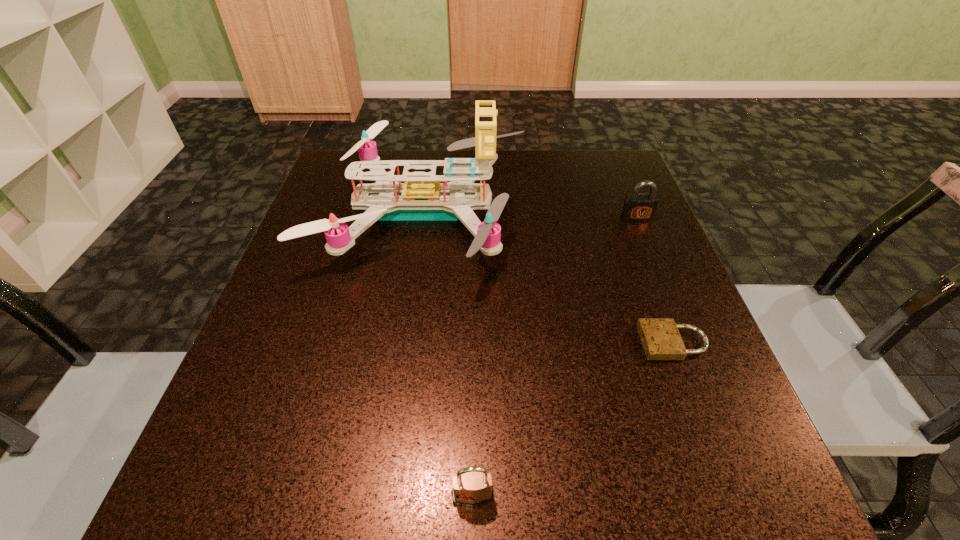
The height and width of the screenshot is (540, 960). What are the coordinates of `vacant space that satisfies the following two spatial constraints: 1. on the front of the farthest padlock near the keyhole; 2. on the keyhole side of the second nearest padlock` in the screenshot? It's located at (688, 342).

The width and height of the screenshot is (960, 540). What are the coordinates of `vacant region that satisfies the following two spatial constraints: 1. on the front-facing side of the drone; 2. on the back side of the nearest object` in the screenshot? It's located at (381, 496).